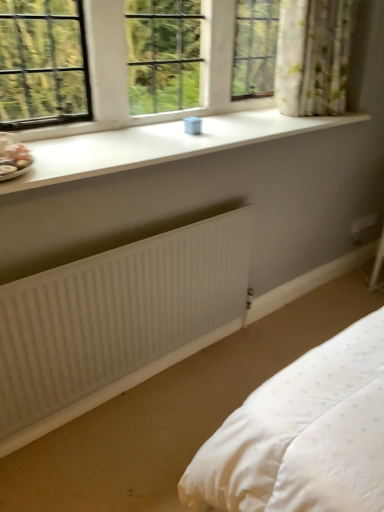
Question: Considering the relative sizes of white smooth window sill at upper center and matte pink porcelain at left in the image provided, is white smooth window sill at upper center smaller than matte pink porcelain at left?

Choices:
 (A) yes
 (B) no

Answer: (B)

Question: Is white smooth window sill at upper center outside of matte pink porcelain at left?

Choices:
 (A) yes
 (B) no

Answer: (A)

Question: Is white smooth window sill at upper center to the left of matte pink porcelain at left from the viewer's perspective?

Choices:
 (A) yes
 (B) no

Answer: (B)

Question: Is white smooth window sill at upper center directly adjacent to matte pink porcelain at left?

Choices:
 (A) yes
 (B) no

Answer: (B)

Question: From a real-world perspective, is white smooth window sill at upper center physically above matte pink porcelain at left?

Choices:
 (A) yes
 (B) no

Answer: (B)

Question: From the image's perspective, does white smooth window sill at upper center appear higher than matte pink porcelain at left?

Choices:
 (A) no
 (B) yes

Answer: (B)

Question: From a real-world perspective, is matte pink porcelain at left physically above white smooth window sill at upper center?

Choices:
 (A) no
 (B) yes

Answer: (B)

Question: Is white smooth window sill at upper center located within matte pink porcelain at left?

Choices:
 (A) no
 (B) yes

Answer: (A)

Question: Does matte pink porcelain at left have a lesser height compared to white smooth window sill at upper center?

Choices:
 (A) no
 (B) yes

Answer: (A)

Question: Considering the relative positions of matte pink porcelain at left and white smooth window sill at upper center in the image provided, is matte pink porcelain at left to the right of white smooth window sill at upper center from the viewer's perspective?

Choices:
 (A) yes
 (B) no

Answer: (B)

Question: From the image's perspective, is matte pink porcelain at left beneath white smooth window sill at upper center?

Choices:
 (A) no
 (B) yes

Answer: (B)

Question: Considering the relative sizes of matte pink porcelain at left and white smooth window sill at upper center in the image provided, is matte pink porcelain at left thinner than white smooth window sill at upper center?

Choices:
 (A) no
 (B) yes

Answer: (B)

Question: Is white plastic container at upper center smaller than matte pink porcelain at left?

Choices:
 (A) no
 (B) yes

Answer: (A)